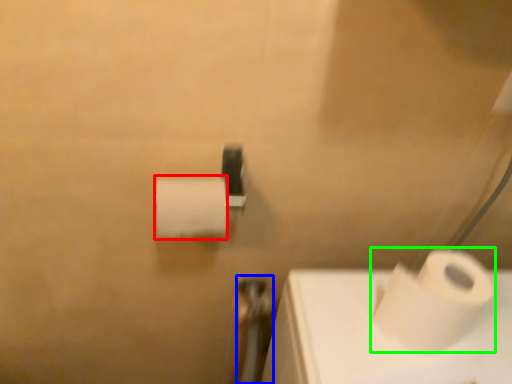
Question: Which object is positioned closest to toilet paper (highlighted by a red box)? Select from shower (highlighted by a blue box) and toilet paper (highlighted by a green box).

Choices:
 (A) shower
 (B) toilet paper

Answer: (B)